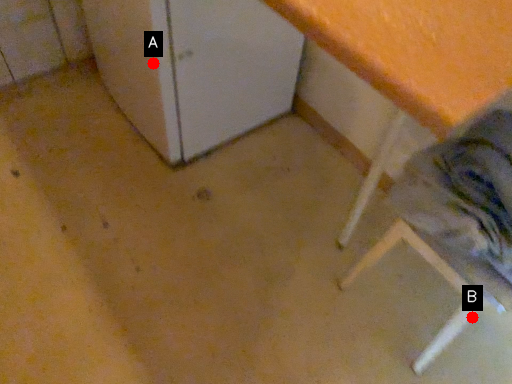
Question: Two points are circled on the image, labeled by A and B beside each circle. Which of the following is the farthest from the observer?

Choices:
 (A) A is further
 (B) B is further

Answer: (B)